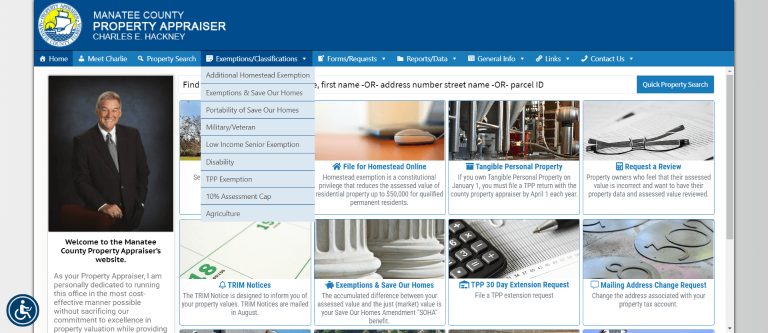
This screenshot has width=768, height=333. What are the coordinates of `chair back` in the screenshot? It's located at (84, 218).